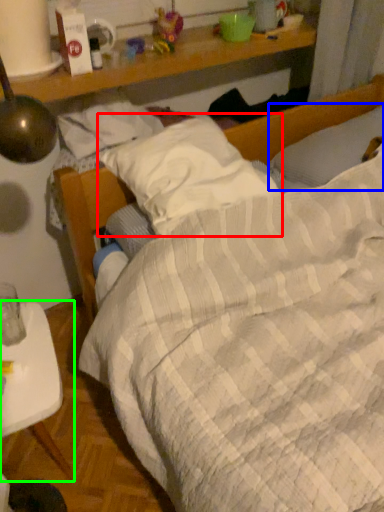
Question: Based on their relative distances, which object is nearer to pillow (highlighted by a red box)? Choose from pillow (highlighted by a blue box) and desk (highlighted by a green box).

Choices:
 (A) pillow
 (B) desk

Answer: (A)